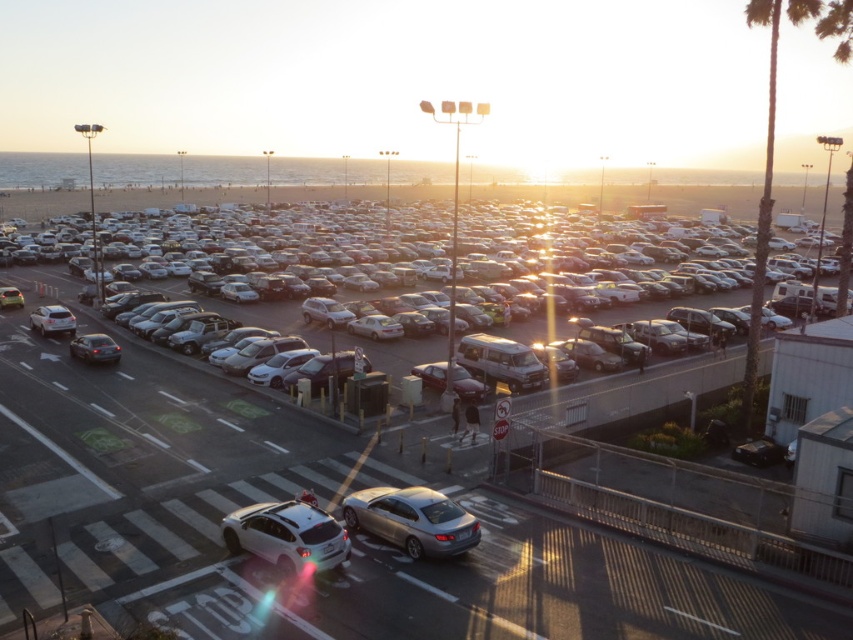
You are a delivery driver who needs to park your truck in the parking lot. The truck requires a space that is at least 13 meters long. Looking at the parking lot with metallic silver cars at center, can you determine if there is enough space between them to park your truck?

The metallic silver cars at center are 12.92 meters apart. Since the truck requires at least 13 meters, there isn not enough space between them to park your truck.

You are standing at the intersection in the parking lot and see two points marked in the image. The first point is at coordinate point(x=404, y=513) and the second is at point(x=235, y=550). According to the image, which point is closer to you?

Point(x=404, y=513) is in front of point(x=235, y=550), so it is closer to you.